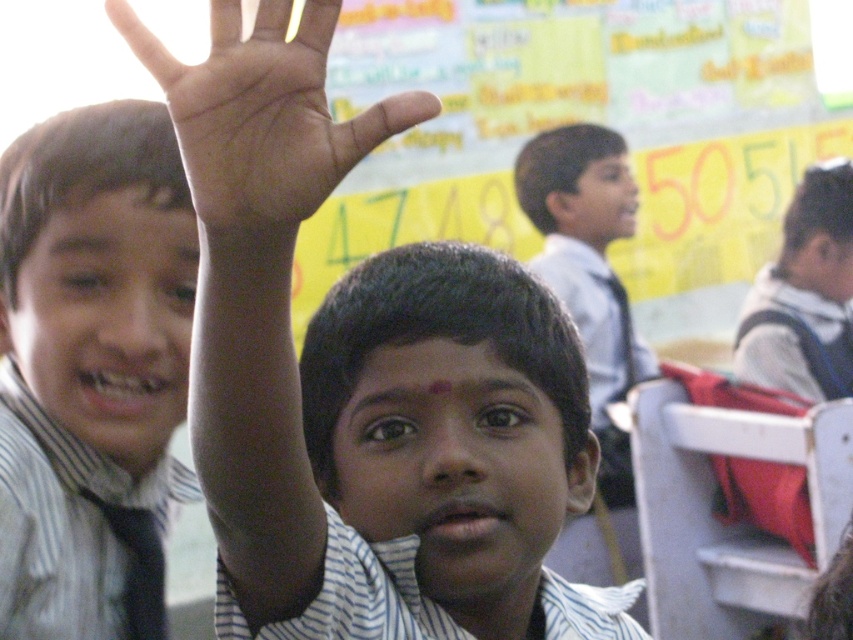
Question: Can you confirm if white striped shirt at center is thinner than striped shirt at left?

Choices:
 (A) no
 (B) yes

Answer: (A)

Question: Is white striped shirt at center smaller than white fabric backpack at right?

Choices:
 (A) yes
 (B) no

Answer: (A)

Question: Which point is closer to the camera taking this photo?

Choices:
 (A) (157, 420)
 (B) (184, 120)

Answer: (B)

Question: Is striped shirt at left wider than black matte tie at upper left?

Choices:
 (A) yes
 (B) no

Answer: (A)

Question: Which object appears farthest from the camera in this image?

Choices:
 (A) black matte tie at upper left
 (B) dark skin palm at upper center
 (C) white fabric backpack at right
 (D) white striped shirt at center

Answer: (C)

Question: Which object appears closest to the camera in this image?

Choices:
 (A) white fabric backpack at right
 (B) white striped shirt at center
 (C) black matte tie at upper left
 (D) dark skin palm at upper center

Answer: (D)